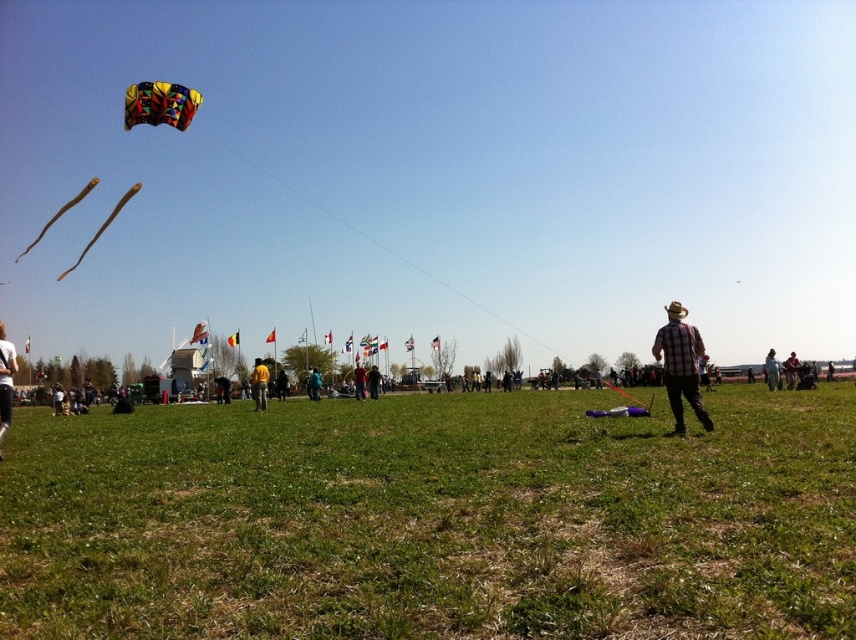
You are standing in the middle of the field and see two people holding the strings of the kite. The person wearing the white cotton shirt at lower left is holding one end, and the person in the light brown leather jacket at lower right is holding the other. If you want to join them, which direction should you walk to reach the person closest to you?

The white cotton shirt at lower left is to the left of the light brown leather jacket at lower right, so the person in the white cotton shirt at lower left is closer to you. You should walk to the left to reach them.